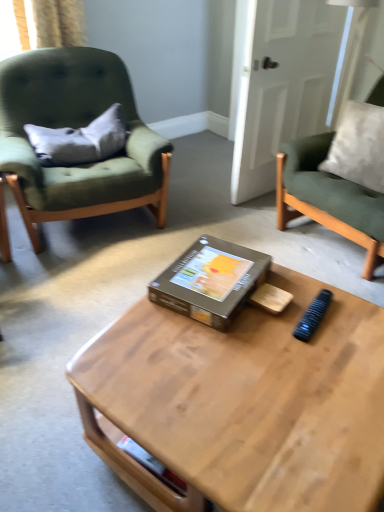
I want to click on free space behind black plastic remote control at center, so click(299, 287).